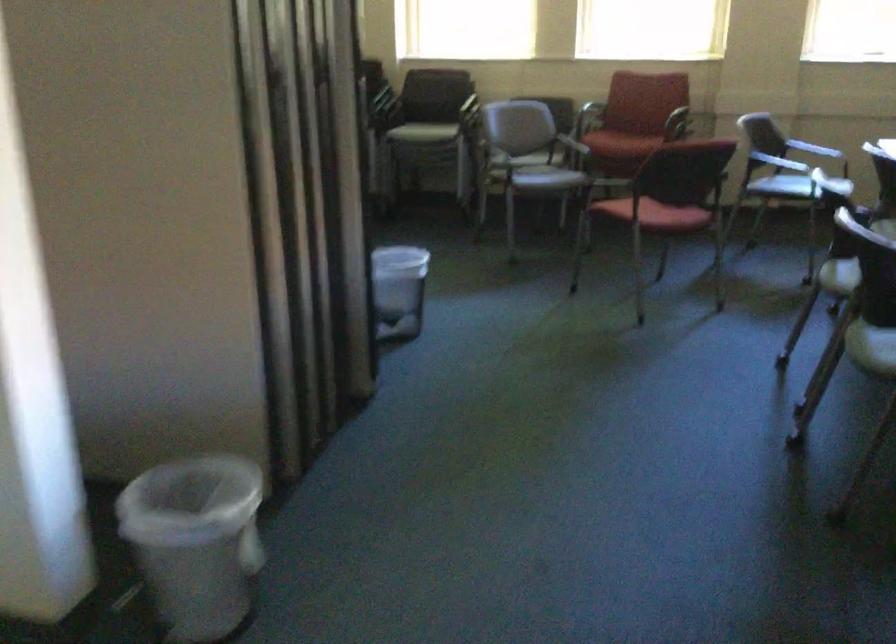
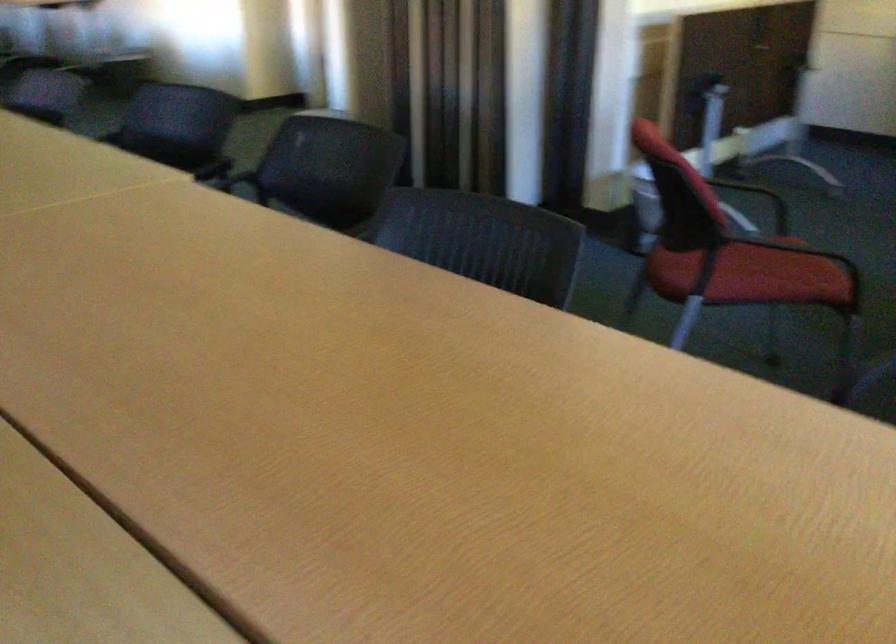
Question: I am providing you with two images of the same scene from different viewpoints. Which of the following objects are not visible in image2?

Choices:
 (A) red chair sitting surface
 (B) dark chair sitting surface
 (C) plastic trash can
 (D) blue ribbon

Answer: (C)